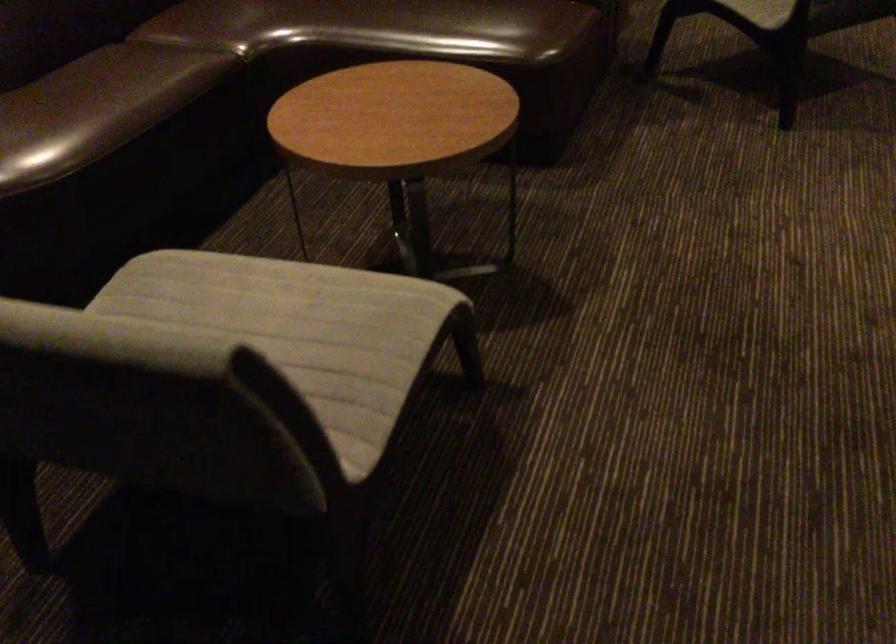
Locate an element on the screen. Image resolution: width=896 pixels, height=644 pixels. brown sofa armrest is located at coordinates (204, 26).